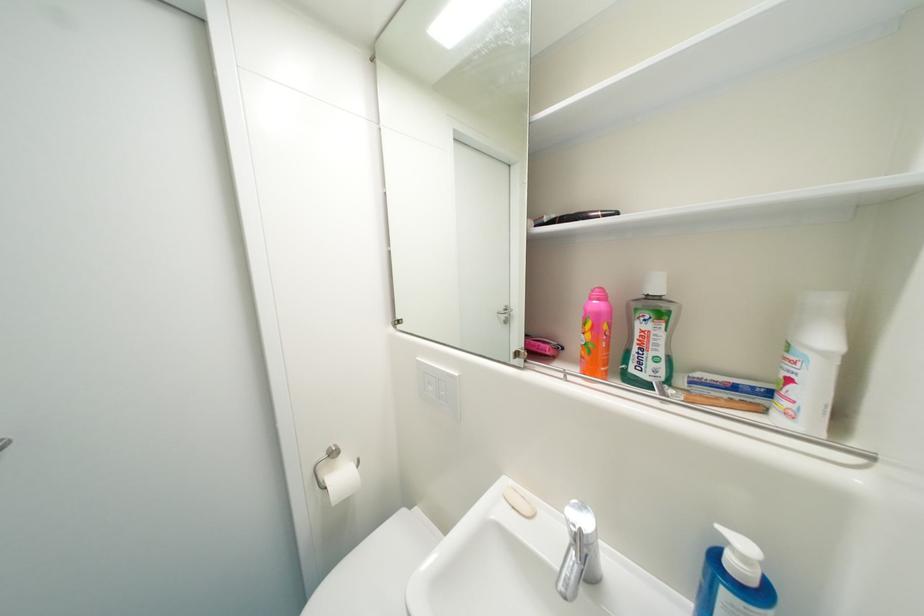
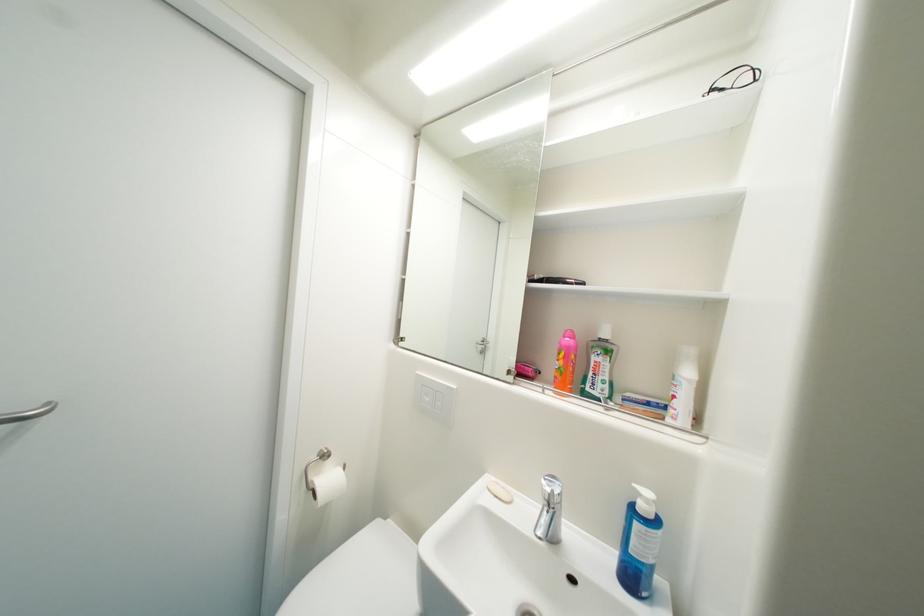
Locate, in the second image, the point that corresponds to point 588,532 in the first image.

(560, 493)